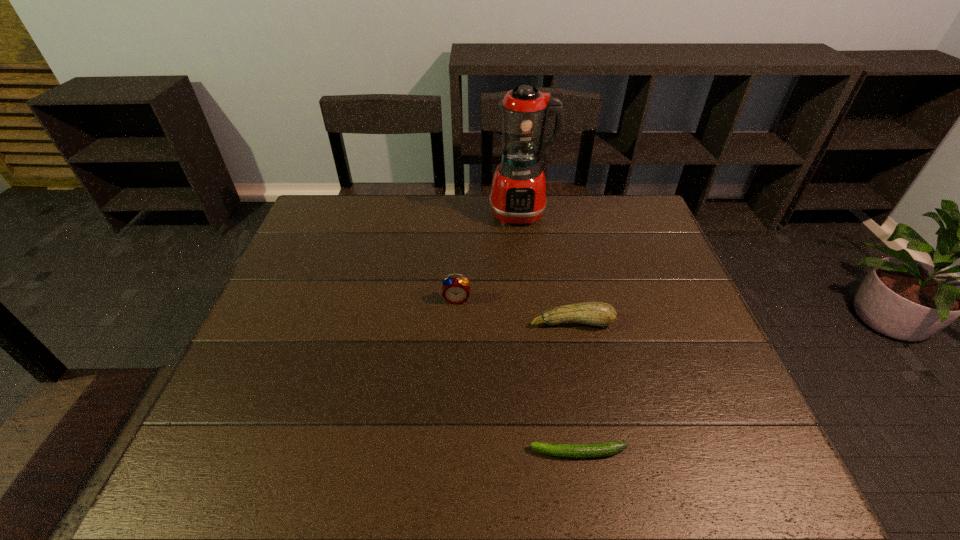
The height and width of the screenshot is (540, 960). Identify the location of vacant point located 0.340m at the stem end of the second nearest object. (601, 468).

Where is `free spot located 0.210m on the front-facing side of the nearer zucchini`? This screenshot has height=540, width=960. free spot located 0.210m on the front-facing side of the nearer zucchini is located at coordinates (423, 453).

You are a GUI agent. You are given a task and a screenshot of the screen. Output one action in this format:
    pyautogui.click(x=<x>, y=<y>)
    Task: Click on the vacant space situated 0.260m on the front-facing side of the nearer zucchini
    The image size is (960, 540).
    Given the screenshot: What is the action you would take?
    pyautogui.click(x=398, y=453)

Locate an element on the screen. free location located 0.190m on the front-facing side of the nearer zucchini is located at coordinates (434, 453).

Locate an element on the screen. The width and height of the screenshot is (960, 540). object that is at the far edge is located at coordinates (518, 196).

I want to click on object that is at the near edge, so click(608, 448).

Find the location of a particular element. The height and width of the screenshot is (540, 960). free space at the far edge of the desktop is located at coordinates (588, 235).

At what (x,y) coordinates should I click in order to perform the action: click on vacant point at the left edge. Please return your answer as a coordinate pair (x, y). Looking at the image, I should click on (239, 373).

Find the location of a particular element. This screenshot has height=540, width=960. vacant point at the right edge is located at coordinates (672, 295).

Locate an element on the screen. free location at the far left corner of the desktop is located at coordinates click(x=336, y=211).